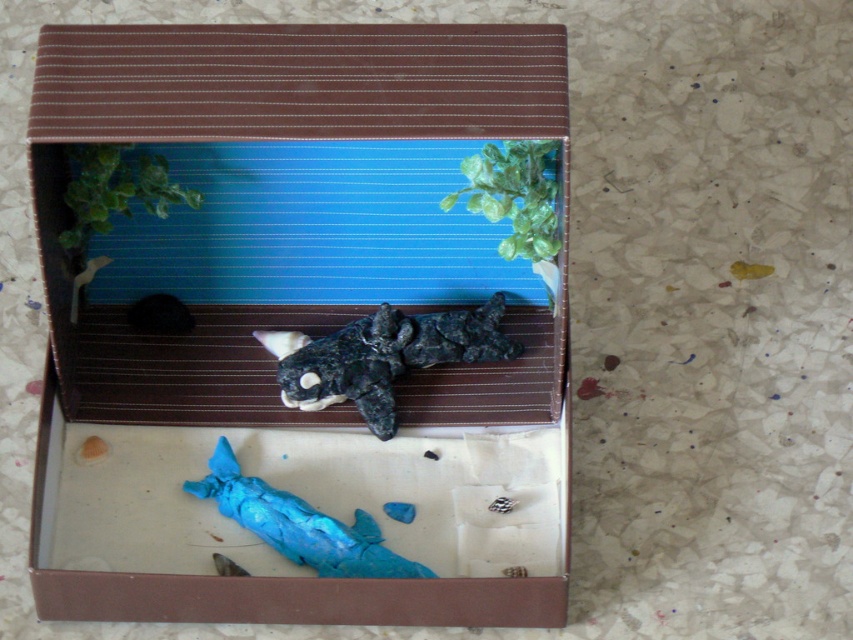
Is matte plastic box at center wider than blue clay whale at lower center?

Yes.

Does matte plastic box at center appear on the left side of blue clay whale at lower center?

Indeed, matte plastic box at center is positioned on the left side of blue clay whale at lower center.

What are the coordinates of `matte plastic box at center` in the screenshot? It's located at (294, 321).

Describe the element at coordinates (515, 195) in the screenshot. I see `green matte plant at upper center` at that location.

Between green matte plant at upper center and green matte plant at upper left, which one has less height?

Standing shorter between the two is green matte plant at upper left.

Find the location of `green matte plant at upper center`. green matte plant at upper center is located at coordinates (515, 195).

Find the location of `green matte plant at upper center`. green matte plant at upper center is located at coordinates (515, 195).

Does point (566, 90) lie behind point (387, 429)?

That is False.

Who is positioned more to the right, matte plastic box at center or matte black orca at center?

matte black orca at center is more to the right.

At what (x,y) coordinates should I click in order to perform the action: click on matte plastic box at center. Please return your answer as a coordinate pair (x, y). Looking at the image, I should click on (294, 321).

Image resolution: width=853 pixels, height=640 pixels. I want to click on matte plastic box at center, so click(294, 321).